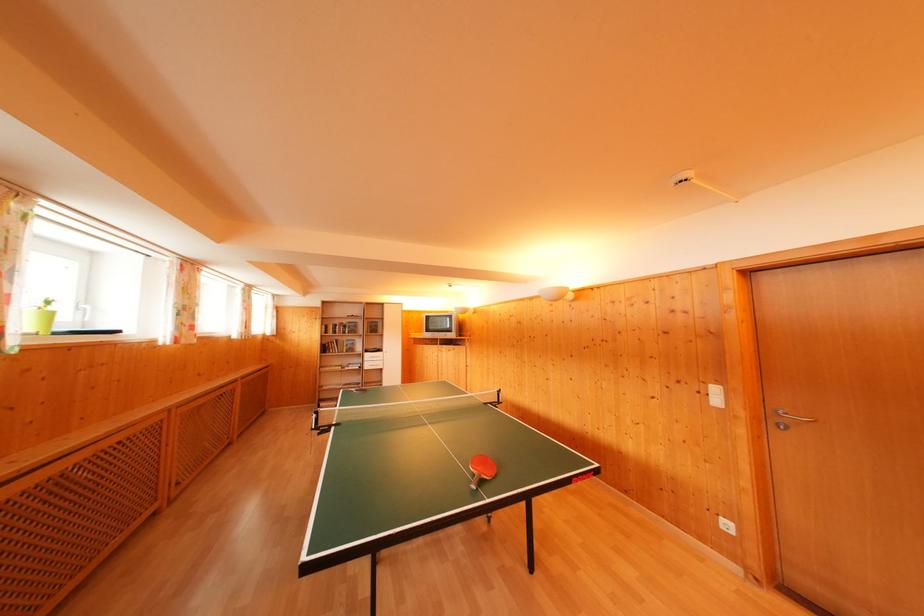
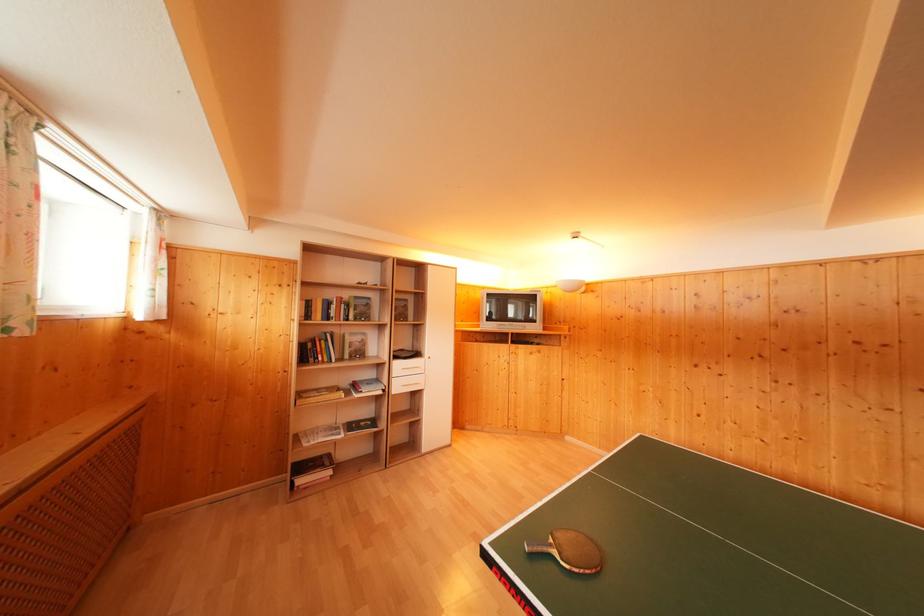
Locate, in the second image, the point that corresponds to the point at 349,344 in the first image.

(350, 336)